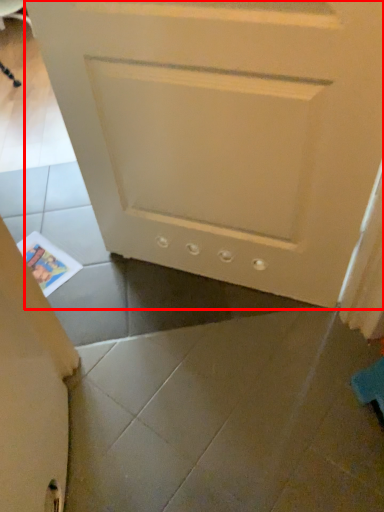
Question: Considering the relative positions of door (annotated by the red box) and magazine in the image provided, where is door (annotated by the red box) located with respect to the staircase?

Choices:
 (A) left
 (B) right

Answer: (B)